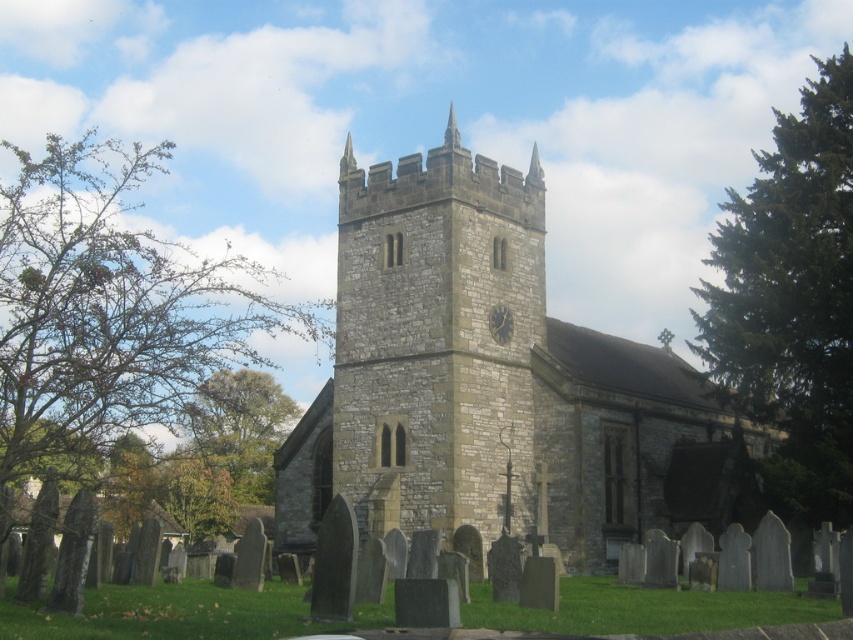
You are standing in the graveyard in front of the historic stone church. You want to take a photo of the stone clock tower at center from the best possible angle. According to the coordinates provided, where exactly should you position yourself relative to the church to capture the tower in the center of your photo?

To capture the stone clock tower at center in the best angle, you should position yourself at the coordinates point (436, 339) relative to the church.

You are a photographer planning to capture a wide shot of the stone church at center and the metallic gray clock at center. Given that your camera can only focus on objects within a 15m width, will both objects fit within the frame?

The stone church at center is wider than the metallic gray clock at center. Since the camera can focus on objects within a 15m width, both objects will fit within the frame as long as their combined width does not exceed 15m. However, the exact fit depends on their individual widths, which are not provided here.